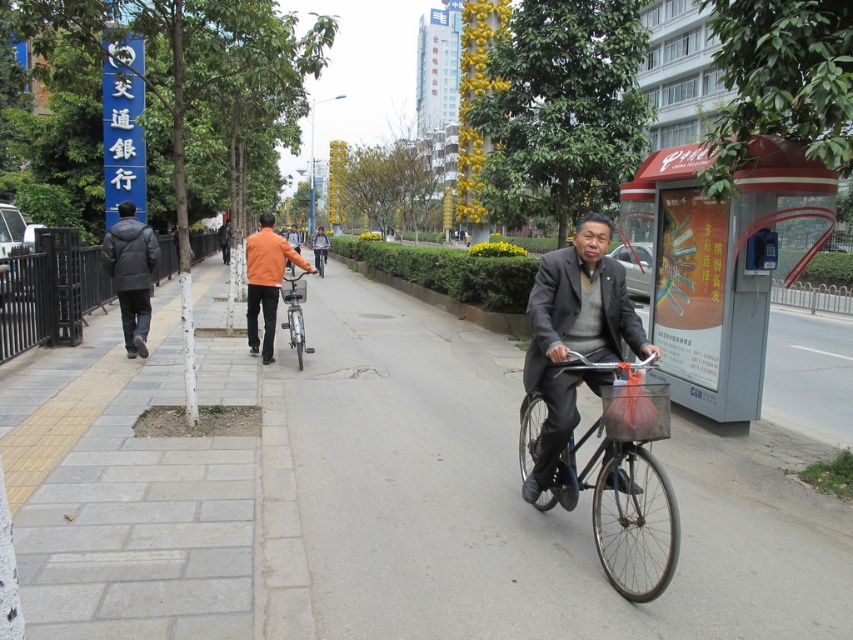
You are standing at the camera position and want to determine which of the two points, point (268, 284) or point (300, 300), is nearer to you. Based on the scene description, which point is closer?

Point (268, 284) is closer to the camera than point (300, 300).

You are a delivery person standing on the gray concrete pavement at center and need to place a package on the shiny black bicycle at center. Can you reach the top of the bicycle from where you are standing?

The gray concrete pavement at center is taller than the shiny black bicycle at center, so you can reach the top of the bicycle from the pavement.